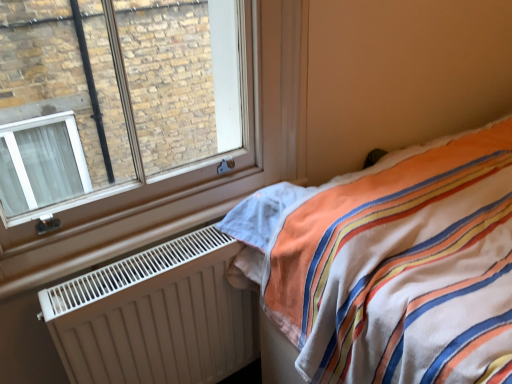
Question: Can you confirm if white matte radiator at lower left is shorter than clear glass window at upper left?

Choices:
 (A) no
 (B) yes

Answer: (B)

Question: From a real-world perspective, does white matte radiator at lower left stand above clear glass window at upper left?

Choices:
 (A) yes
 (B) no

Answer: (B)

Question: Can you confirm if white matte radiator at lower left is positioned to the right of clear glass window at upper left?

Choices:
 (A) yes
 (B) no

Answer: (B)

Question: From the image's perspective, is white matte radiator at lower left located above clear glass window at upper left?

Choices:
 (A) yes
 (B) no

Answer: (B)

Question: Is white matte radiator at lower left wider than clear glass window at upper left?

Choices:
 (A) yes
 (B) no

Answer: (A)

Question: From a real-world perspective, is white matte radiator at lower left positioned under clear glass window at upper left based on gravity?

Choices:
 (A) yes
 (B) no

Answer: (A)

Question: Is striped cotton bed at right not within white matte radiator at lower left?

Choices:
 (A) yes
 (B) no

Answer: (A)

Question: Does striped cotton bed at right contain white matte radiator at lower left?

Choices:
 (A) yes
 (B) no

Answer: (B)

Question: Can you confirm if striped cotton bed at right is taller than white matte radiator at lower left?

Choices:
 (A) no
 (B) yes

Answer: (B)

Question: From a real-world perspective, is striped cotton bed at right positioned over white matte radiator at lower left based on gravity?

Choices:
 (A) yes
 (B) no

Answer: (A)

Question: Is striped cotton bed at right positioned with its back to white matte radiator at lower left?

Choices:
 (A) no
 (B) yes

Answer: (A)

Question: Is striped cotton bed at right far away from white matte radiator at lower left?

Choices:
 (A) yes
 (B) no

Answer: (B)

Question: Does clear glass window at upper left have a greater width compared to striped cotton bed at right?

Choices:
 (A) no
 (B) yes

Answer: (A)